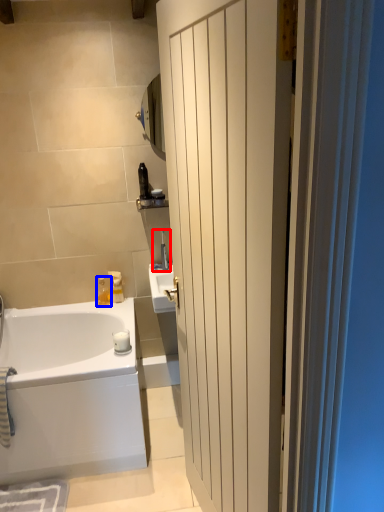
Question: Which object appears farthest to the camera in this image, faucet (highlighted by a red box) or toiletry (highlighted by a blue box)?

Choices:
 (A) faucet
 (B) toiletry

Answer: (B)